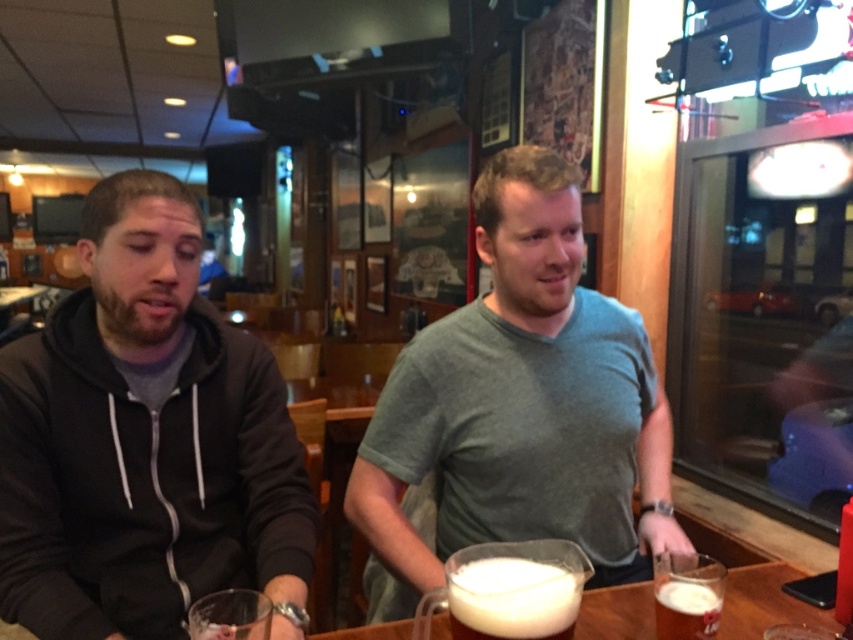
Question: Which of the following is the closest to the observer?

Choices:
 (A) gray matte shirt at center
 (B) white frothy foam at lower center

Answer: (B)

Question: Which object appears farthest from the camera in this image?

Choices:
 (A) dark gray hoodie at left
 (B) gray matte shirt at center
 (C) white frothy liquid at lower right
 (D) white frothy liquid at center

Answer: (B)

Question: Which object appears farthest from the camera in this image?

Choices:
 (A) dark gray hoodie at left
 (B) gray matte shirt at center
 (C) white frothy foam at lower center
 (D) white frothy liquid at lower right

Answer: (B)

Question: Does dark gray hoodie at left appear under white frothy liquid at center?

Choices:
 (A) yes
 (B) no

Answer: (B)

Question: Is the position of gray matte shirt at center less distant than that of white frothy liquid at lower right?

Choices:
 (A) yes
 (B) no

Answer: (B)

Question: Does white frothy foam at lower center have a greater width compared to white frothy liquid at lower right?

Choices:
 (A) yes
 (B) no

Answer: (A)